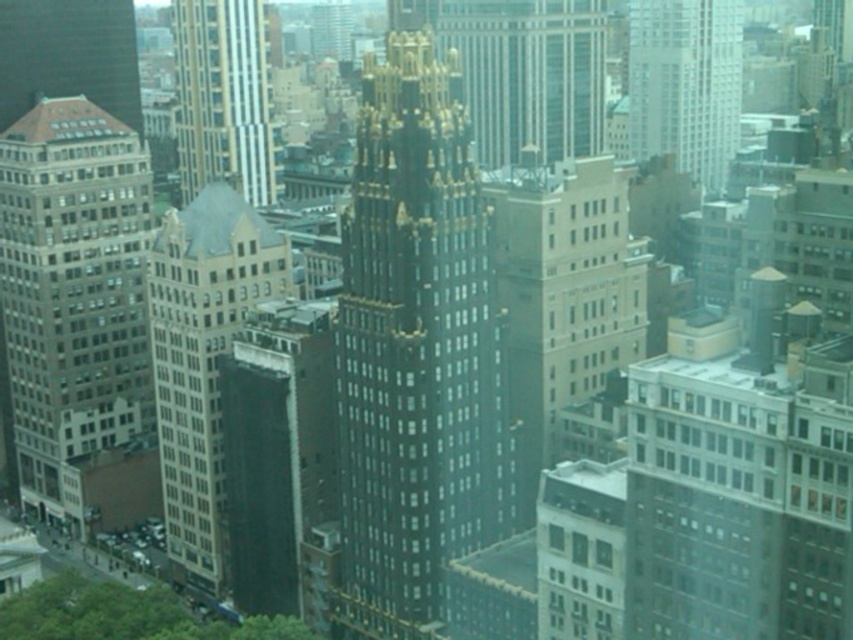
Is beige concrete building at center below dark gray concrete building at center?

No, beige concrete building at center is not below dark gray concrete building at center.

Who is positioned more to the right, beige concrete building at center or dark gray concrete building at center?

beige concrete building at center is more to the right.

Locate an element on the screen. The width and height of the screenshot is (853, 640). beige concrete building at center is located at coordinates (561, 298).

Who is more distant from viewer, [148,433] or [51,4]?

The point [148,433] is behind.

Who is taller, dark gray stone building at left or matte brown building at upper left?

dark gray stone building at left

Does point (44, 256) come farther from viewer compared to point (82, 48)?

No, it is not.

Where is `dark gray stone building at left`? This screenshot has width=853, height=640. dark gray stone building at left is located at coordinates (73, 289).

Can you confirm if gold/golden glass tower at upper center is bigger than matte brown building at upper left?

Correct, gold/golden glass tower at upper center is larger in size than matte brown building at upper left.

Which of these two, gold/golden glass tower at upper center or matte brown building at upper left, stands taller?

gold/golden glass tower at upper center

Where is `gold/golden glass tower at upper center`? Image resolution: width=853 pixels, height=640 pixels. gold/golden glass tower at upper center is located at coordinates (222, 97).

Locate an element on the screen. The image size is (853, 640). gold/golden glass tower at upper center is located at coordinates (222, 97).